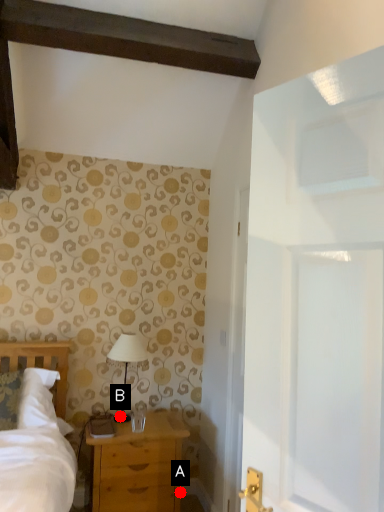
Question: Two points are circled on the image, labeled by A and B beside each circle. Which point appears farthest from the camera in this image?

Choices:
 (A) A is further
 (B) B is further

Answer: (A)